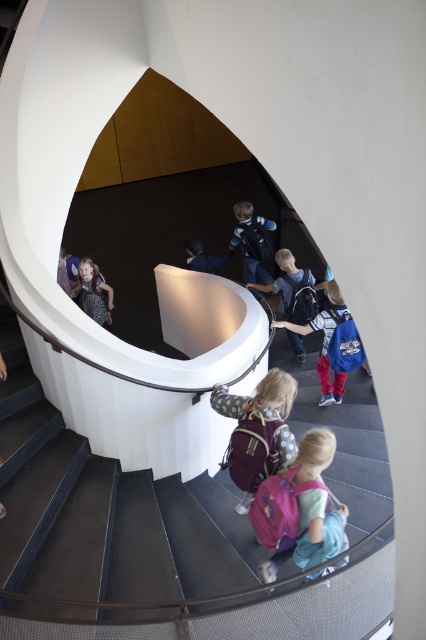
Question: Which point appears closest to the camera in this image?

Choices:
 (A) (322, 374)
 (B) (250, 262)
 (C) (304, 465)
 (D) (271, 392)

Answer: (C)

Question: Does dark blue backpack at center have a lesser width compared to matte black backpack at lower center?

Choices:
 (A) no
 (B) yes

Answer: (A)

Question: Is white matte staircase at center positioned in front of dark blue backpack at center?

Choices:
 (A) yes
 (B) no

Answer: (A)

Question: Can you confirm if white matte staircase at center is positioned above matte purple backpack at center?

Choices:
 (A) yes
 (B) no

Answer: (B)

Question: Which object appears farthest from the camera in this image?

Choices:
 (A) dark blue backpack at center
 (B) blue fabric jacket at center
 (C) pink fabric backpack at lower center

Answer: (B)

Question: Among these objects, which one is farthest from the camera?

Choices:
 (A) blue fabric jacket at center
 (B) white matte staircase at center
 (C) pink fabric backpack at lower center

Answer: (A)